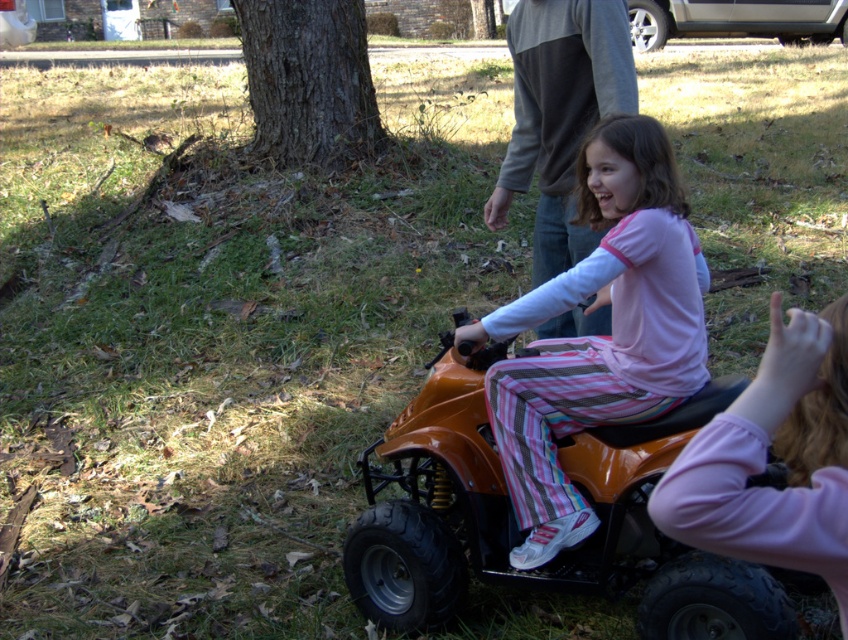
Question: Which object is positioned farthest from the orange rubber toy car at center?

Choices:
 (A) pink fabric hand at lower right
 (B) gray sweater at upper center

Answer: (A)

Question: Does orange rubber toy car at center appear under gray sweater at upper center?

Choices:
 (A) yes
 (B) no

Answer: (A)

Question: Which of the following is the closest to the observer?

Choices:
 (A) orange plastic toy car at upper right
 (B) matte orange quad bike at center
 (C) pink fabric hand at lower right
 (D) gray sweater at upper center

Answer: (C)

Question: Which object appears farthest from the camera in this image?

Choices:
 (A) orange rubber toy car at center
 (B) matte orange quad bike at center

Answer: (B)

Question: Can you confirm if orange rubber toy car at center is smaller than pink fabric hand at lower right?

Choices:
 (A) no
 (B) yes

Answer: (A)

Question: Does orange rubber toy car at center have a lesser width compared to matte orange quad bike at center?

Choices:
 (A) yes
 (B) no

Answer: (B)